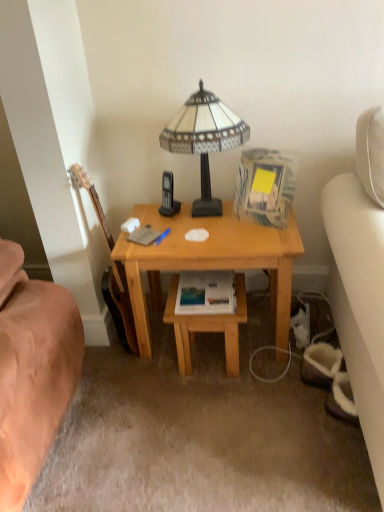
I want to click on blank space above matte paper paperback book at center (from a real-world perspective), so click(x=210, y=286).